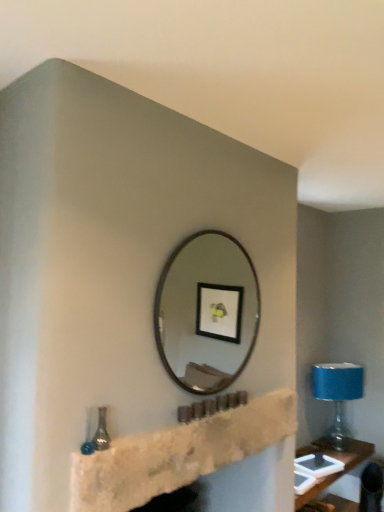
Where is `vacant space situated above stone fireplace at center (from a real-world perspective)`? This screenshot has height=512, width=384. vacant space situated above stone fireplace at center (from a real-world perspective) is located at coordinates (230, 402).